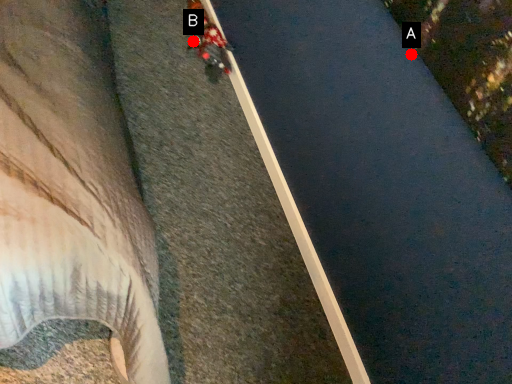
Question: Two points are circled on the image, labeled by A and B beside each circle. Which point is closer to the camera taking this photo?

Choices:
 (A) A is closer
 (B) B is closer

Answer: (A)